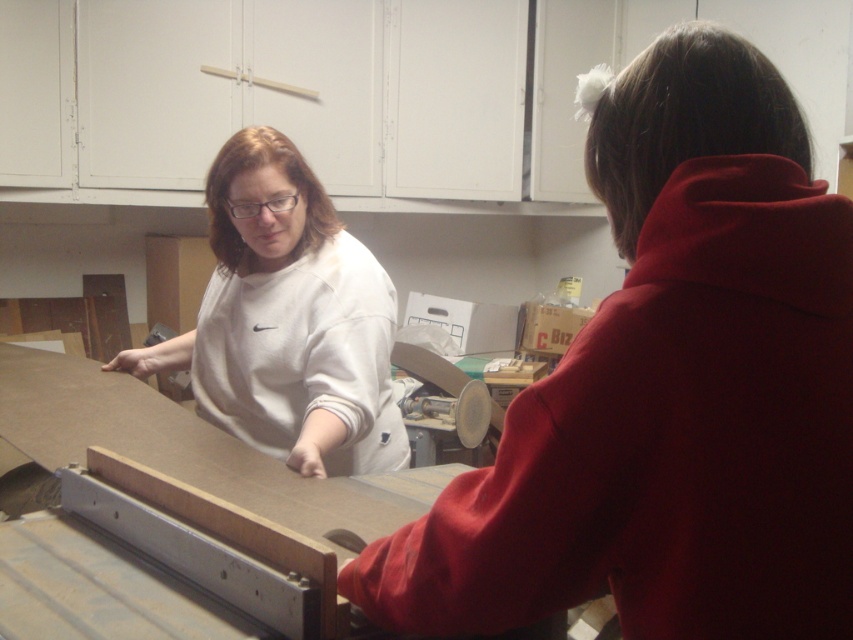
You are trying to locate the white matte sweatshirt at upper left and the white matte sweatshirt at center in the workshop scene. According to the spatial arrangement, which sweatshirt is located to the right of the other?

The white matte sweatshirt at upper left is positioned on the right side of white matte sweatshirt at center, so the sweatshirt at upper left is to the right of the one at center.

You are standing in the workshop and need to place a small tool exactly at point (669, 390). What object is located at that point?

The white matte sweatshirt at upper left is located at point (669, 390).